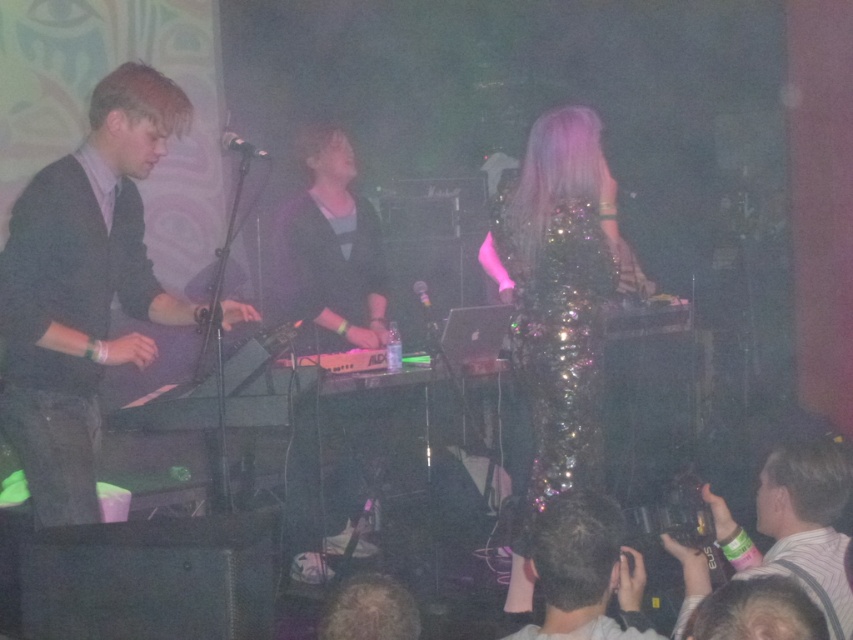
You are a stagehand who needs to place a microphone stand exactly at point (329, 253). What object is already located there?

The matte black keyboard at center is located at point (329, 253).

You are a photographer at the back of the venue, and you want to take a photo of both the matte black keyboard at center and the shiny sequined dress at center. If your camera has a maximum focus range of 6 feet, can you capture both objects in focus simultaneously?

The matte black keyboard at center is 6.50 feet away from the shiny sequined dress at center. Since the distance between them is greater than the camera maximum focus range of 6 feet, you cannot capture both objects in focus simultaneously.

You are a photographer at the back of the venue. You want to take a photo of the matte black keyboard at center and the white striped shirt at lower right. Which object should you focus on first if you want to capture both in a single shot without moving the camera?

The matte black keyboard at center is taller than the white striped shirt at lower right, so you should focus on the matte black keyboard at center first to ensure it is in focus before the shorter white striped shirt at lower right.